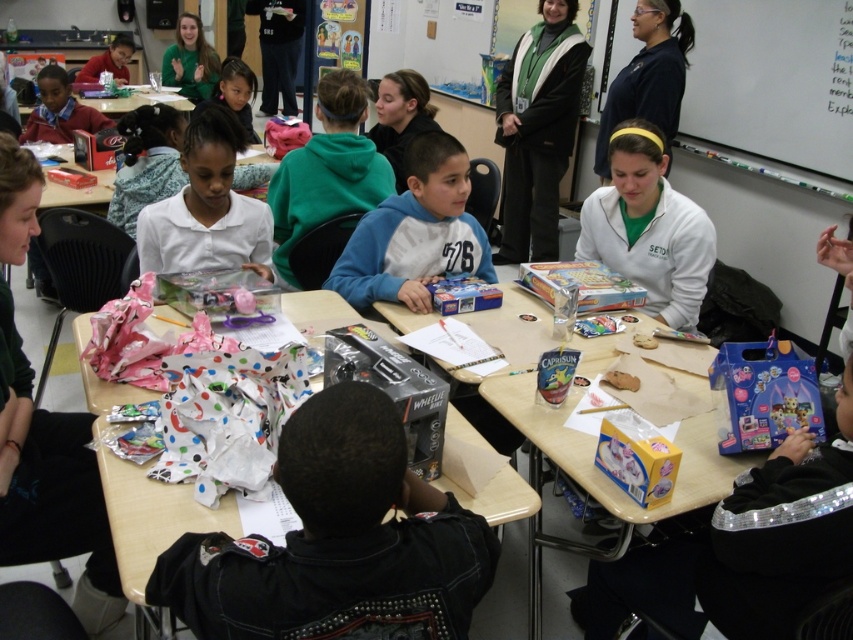
You are organizing a classroom activity and need to place a large poster on the yellow cardboard table at center and the green matte shirt at upper center. Which surface can accommodate the poster based on their sizes?

The yellow cardboard table at center has a larger width than the green matte shirt at upper center, so the poster can be placed on the yellow cardboard table at center.